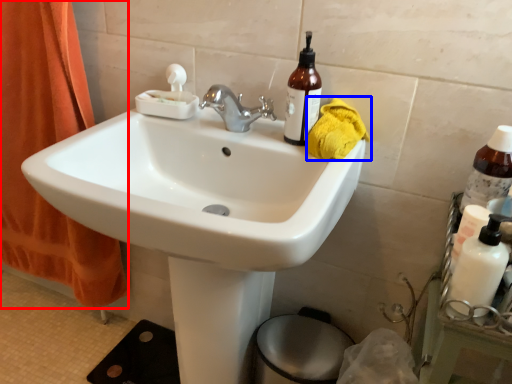
Question: Which point is closer to the camera, curtain (highlighted by a red box) or material (highlighted by a blue box)?

Choices:
 (A) curtain
 (B) material

Answer: (B)